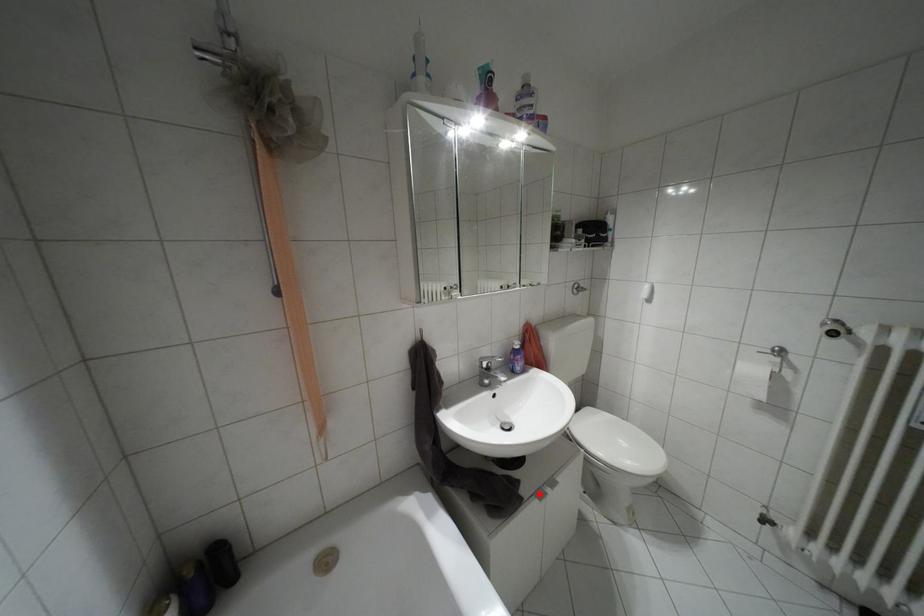
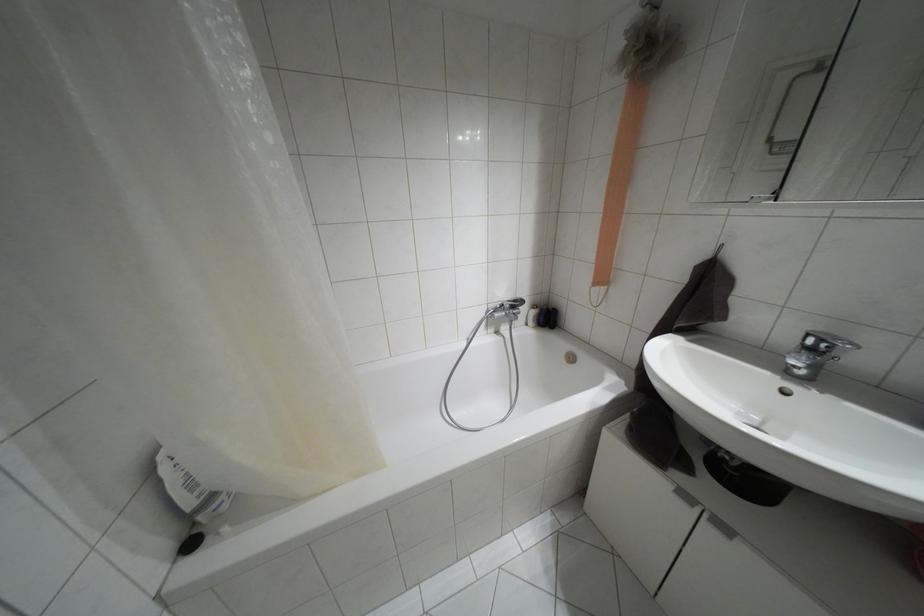
Question: I am providing you with two images of the same scene from different viewpoints. A red point is marked on the first image. At the location where the point appears in image 1, is it still visible in image 2?

Choices:
 (A) Yes
 (B) No

Answer: (A)